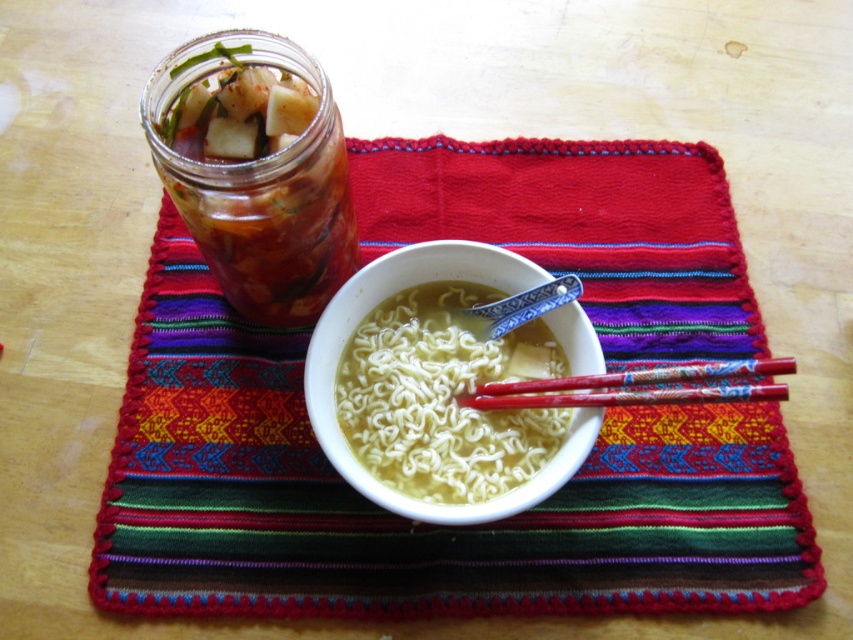
You are a food delivery person who needs to place a hot meal container on the table. The container requires a space of at least 20 centimeters between it and any other items to prevent heat transfer. Given the current arrangement, can you safely place the container between the multicolored woven placemat at center and the red lacquered chopsticks at center?

The distance between the multicolored woven placemat at center and the red lacquered chopsticks at center is 21.63 centimeters. Since the required minimum distance is 20 centimeters, the container can be safely placed between them as the existing space meets the requirement.

You are standing at a distance of 1 meter from the wooden table. The point at coordinates point (457, 504) is where you want to place a small spoon. Can you reach that point without moving your hand closer to the table?

The distance of point (457, 504) from the camera is 81.44 centimeters. Since you are standing 1 meter away, which is 100 centimeters, the point is closer to you than your current position. Therefore, you can reach it without moving your hand closer to the table.

You are a food delivery robot that needs to pick up the red lacquered chopsticks at center from the table. The robot has a 4 inch wide arm. Can the robot reach the chopsticks without touching the white ceramic bowl at center?

The white ceramic bowl at center and red lacquered chopsticks at center are 4.16 inches apart. Since the robot arm is 4 inches wide, there is enough space between the bowl and chopsticks for the robot to reach the chopsticks without touching the bowl.